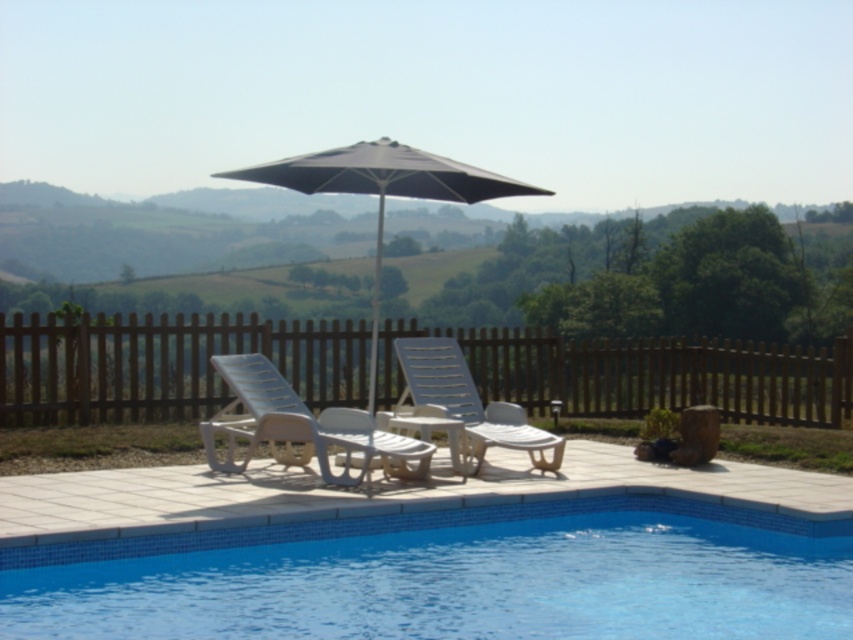
You are standing at the edge of the pool looking towards the wooden fence. There are two points marked in the scene, point (242, 468) and point (445, 408). Which point is closer to you?

Point (242, 468) is closer to the camera than point (445, 408), so it is the closer point.

You are a maintenance worker who needs to move a 36 inch long garden hose from one chair to the other. Can you move the hose without it dragging on the ground between the white plastic beach chair at center and the white plastic lounge chair at center?

The distance between the white plastic beach chair at center and the white plastic lounge chair at center is 37.85 inches. Since the garden hose is 36 inches long, it is shorter than the distance between the chairs. Therefore, the hose will drag on the ground when moving it between them.

You are planning to sit on one of the chairs near the pool. Which chair, the white plastic beach chair at center or the white plastic lounge chair at center, is shorter and thus might be more comfortable for someone who prefers a lower seating position?

The white plastic beach chair at center is shorter than the white plastic lounge chair at center, making it more comfortable for someone who prefers a lower seating position.